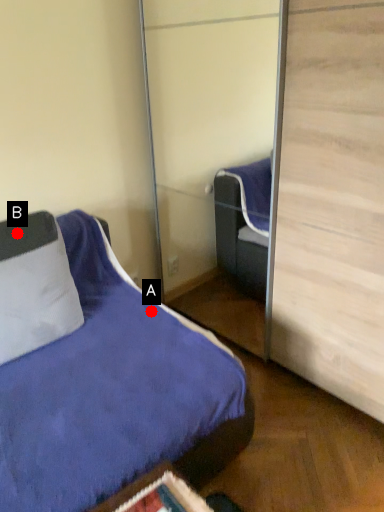
Question: Two points are circled on the image, labeled by A and B beside each circle. Which point is farther to the camera?

Choices:
 (A) A is further
 (B) B is further

Answer: (A)